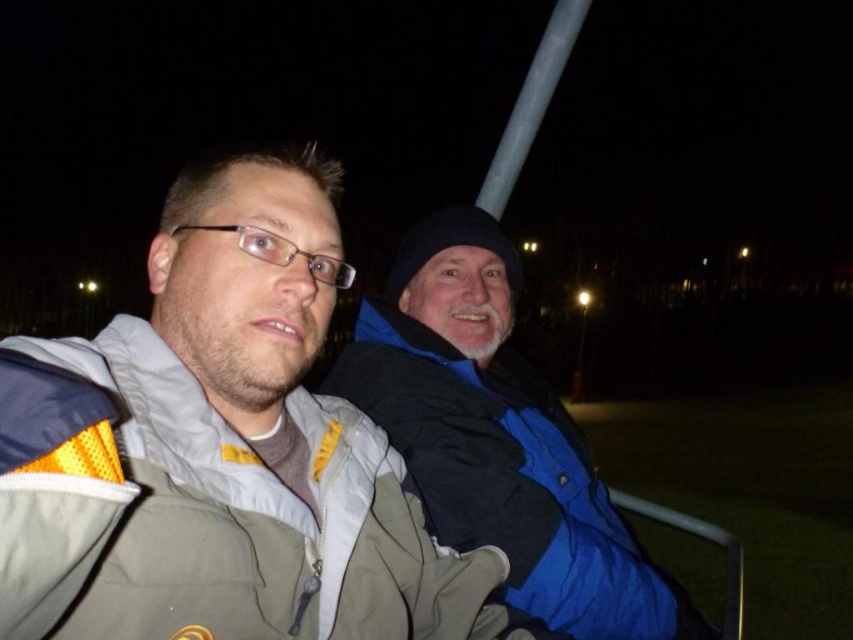
You are standing in front of the two people in the image. You want to throw a small ball to the person who is closer to you. Which point should you aim for, point (457,474) or point (738,547)?

You should aim for point (457,474) because it is closer to the viewer than point (738,547).

You are trying to determine if the blue fleece jacket at right can be placed on the metallic gray rail at lower right. Based on their sizes, will it fit?

The blue fleece jacket at right is wider than the metallic gray rail at lower right, so it may not fit properly on the rail.